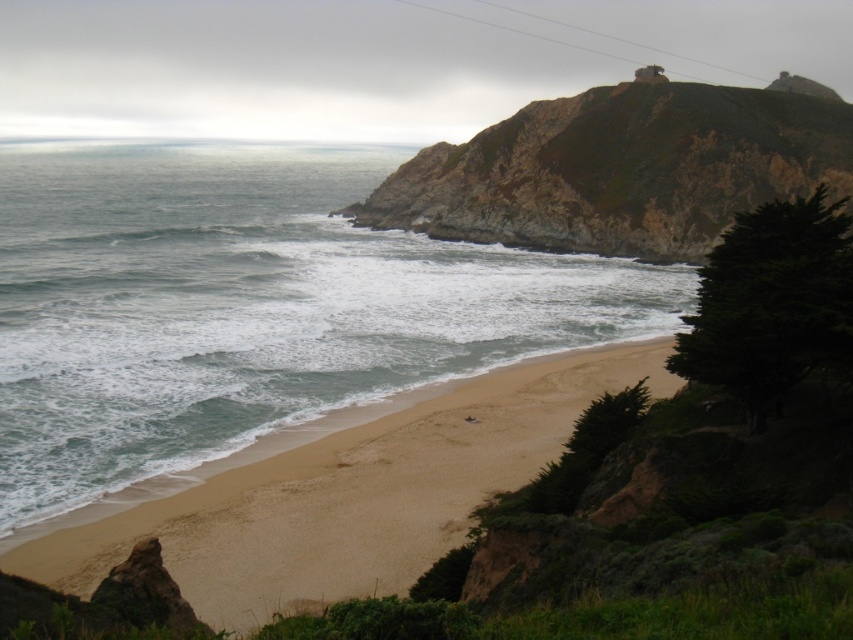
Question: Which point is closer to the camera?

Choices:
 (A) (428, 352)
 (B) (157, 512)
 (C) (633, 96)

Answer: (B)

Question: Does light brown sand at lower center come in front of rugged rock cliff at upper right?

Choices:
 (A) yes
 (B) no

Answer: (A)

Question: Is greenish-blue water at center to the right of light brown sand at lower center from the viewer's perspective?

Choices:
 (A) no
 (B) yes

Answer: (A)

Question: Among these objects, which one is farthest from the camera?

Choices:
 (A) rugged rock cliff at upper right
 (B) greenish-blue water at center

Answer: (A)

Question: Does light brown sand at lower center have a smaller size compared to rugged rock cliff at upper right?

Choices:
 (A) yes
 (B) no

Answer: (A)

Question: Which of these objects is positioned closest to the rugged rock cliff at upper right?

Choices:
 (A) greenish-blue water at center
 (B) light brown sand at lower center

Answer: (A)